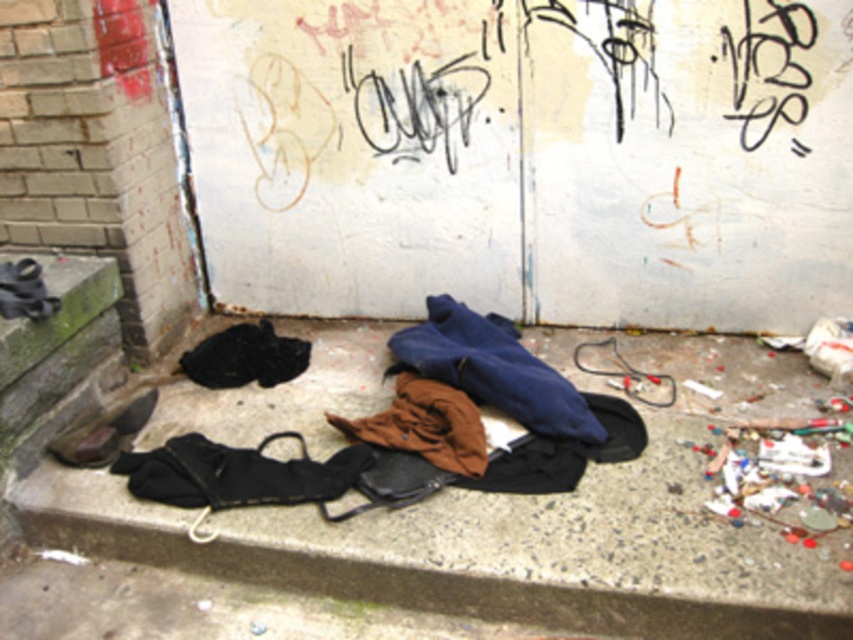
Does blue cotton hoodie at center appear on the left side of leather shoe at lower left?

In fact, blue cotton hoodie at center is to the right of leather shoe at lower left.

How much distance is there between blue cotton hoodie at center and leather shoe at lower left?

blue cotton hoodie at center and leather shoe at lower left are 1.10 meters apart.

Is point (485, 372) behind point (148, 394)?

No, (485, 372) is closer to viewer.

This screenshot has height=640, width=853. In order to click on blue cotton hoodie at center in this screenshot , I will do `click(492, 369)`.